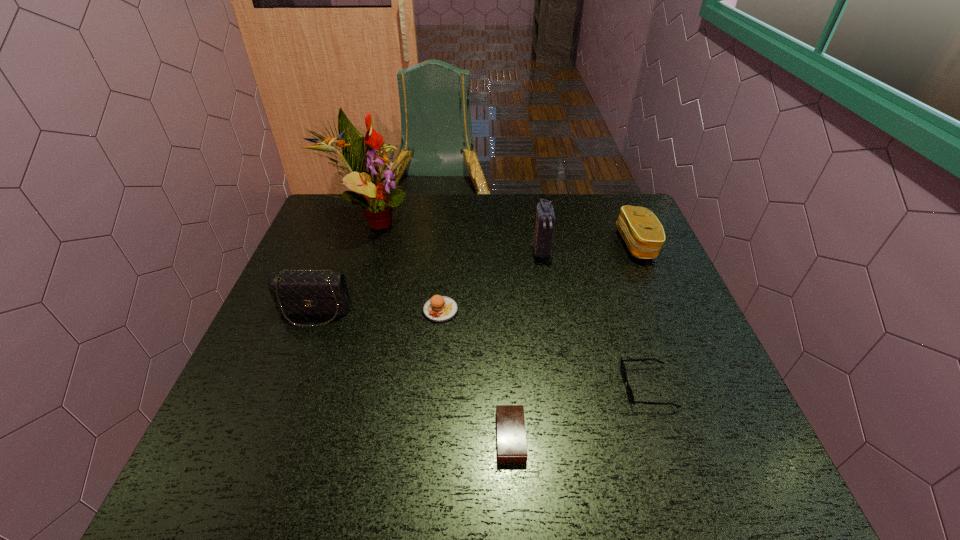
This screenshot has height=540, width=960. In order to click on clutch bag present at the left edge in this screenshot , I will do `click(295, 293)`.

Identify the location of clutch bag positioned at the right edge. Image resolution: width=960 pixels, height=540 pixels. (642, 232).

This screenshot has width=960, height=540. I want to click on sunglasses that is positioned at the right edge, so click(x=629, y=391).

Locate an element on the screen. Image resolution: width=960 pixels, height=540 pixels. object present at the far left corner is located at coordinates (363, 157).

I want to click on object that is at the far right corner, so click(642, 232).

The image size is (960, 540). Find the location of `free space at the far edge of the desktop`. free space at the far edge of the desktop is located at coordinates (529, 202).

The width and height of the screenshot is (960, 540). I want to click on free space at the near edge, so click(349, 498).

The width and height of the screenshot is (960, 540). What are the coordinates of `blank space at the right edge of the desktop` in the screenshot? It's located at (618, 299).

Where is `vacant area at the far left corner of the desktop`? This screenshot has width=960, height=540. vacant area at the far left corner of the desktop is located at coordinates (314, 234).

Locate an element on the screen. This screenshot has height=540, width=960. free space at the far right corner is located at coordinates (606, 199).